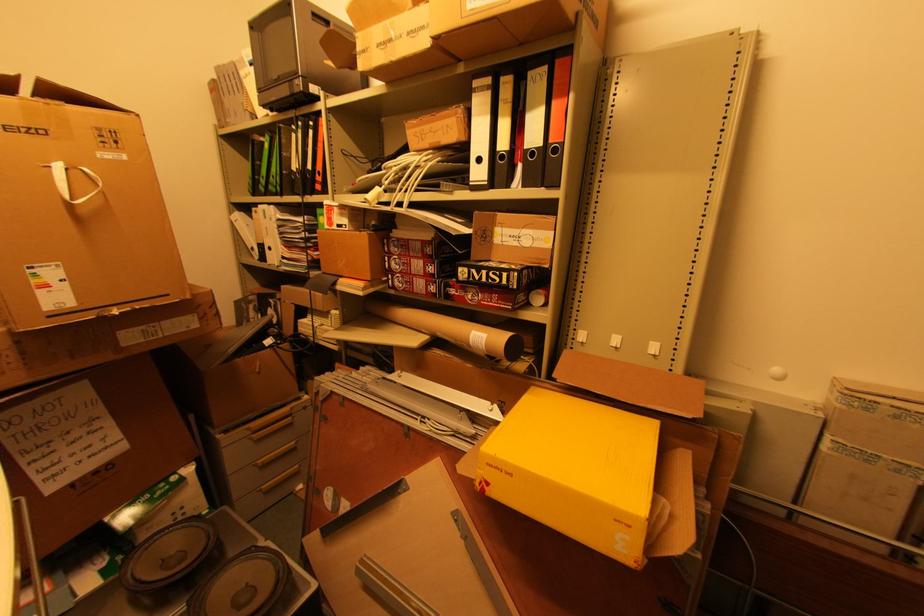
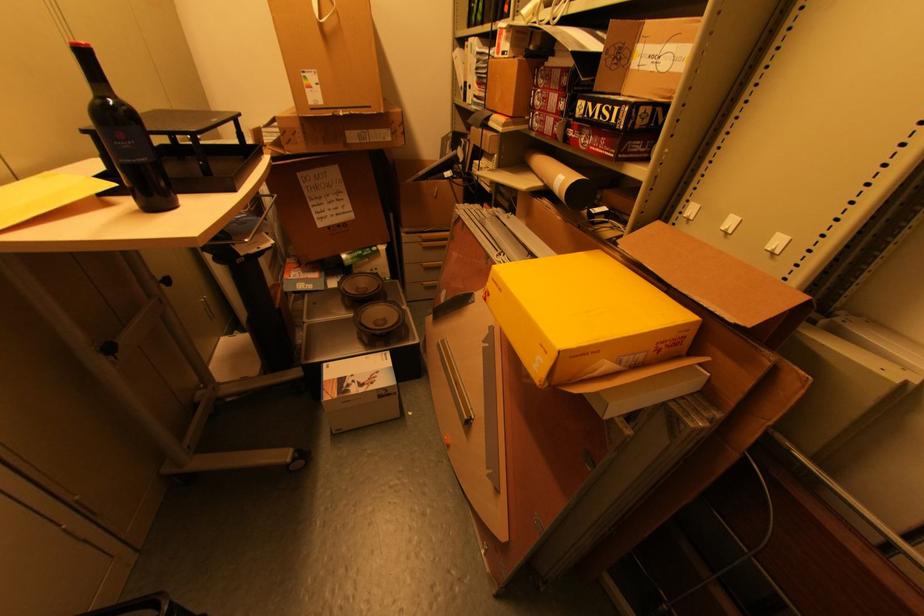
Locate, in the second image, the point that corresponds to point (646, 406) in the first image.

(688, 294)